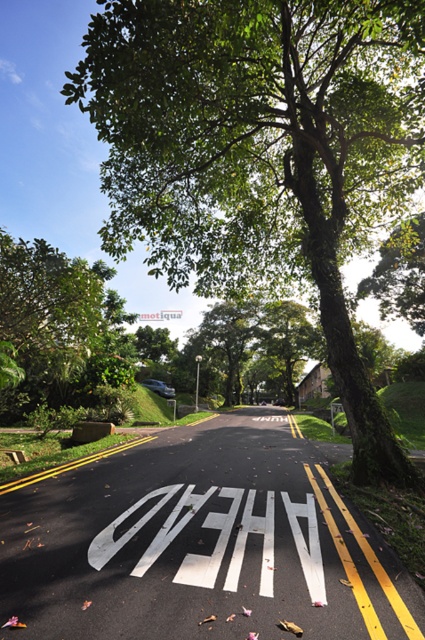
You are a photographer standing at the edge of the road. You want to take a photo of the green leafy tree at center from exactly 6 meters away. Based on the scene description, can you position yourself correctly to achieve this distance?

The green leafy tree at center and camera are 5.72 meters apart. Since 5.72 meters is slightly less than 6 meters, you can move back a small distance to reach the desired 6 meters for your photo.

You are standing at the center of the road and looking towards the direction the road curves. Which side of the road is the green leafy tree at upper left located relative to your viewpoint?

The green leafy tree at upper left is located on the left side of the road relative to your viewpoint.

You are a driver approaching the road and see the green leafy tree at center. If you want to avoid hitting the tree, which direction should you steer your car?

The green leafy tree at center is located at point 0.241 on the x axis and 0.616 on the y axis. To avoid hitting the tree, you should steer your car away from the coordinates where the tree is positioned. Since the tree is at center, steering left or right depends on the road curvature. The road curves gently to the right, so steering right would align with the road curve and avoid the tree on the right side.